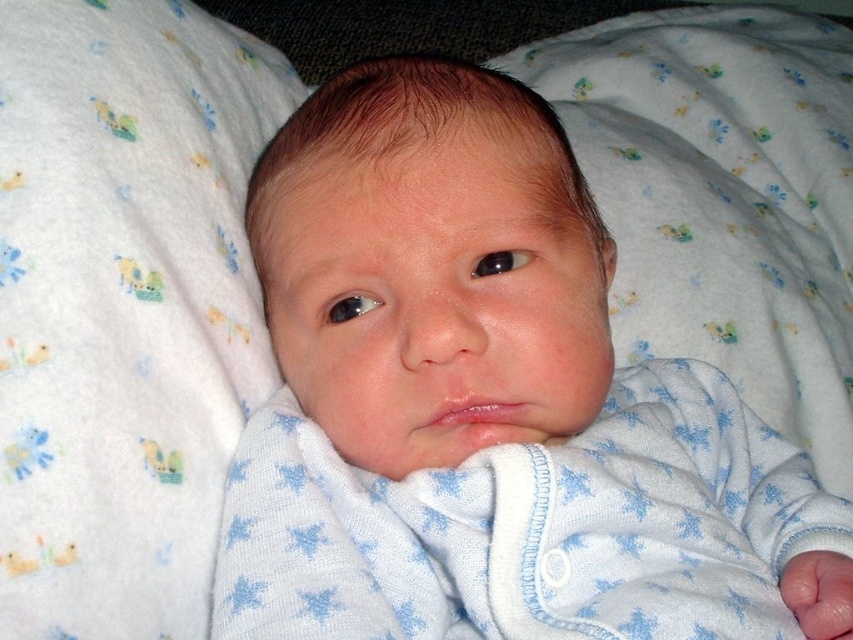
You are a photographer taking a close up of a newborn baby. You have two points marked on your screen at coordinates point [440,493] and point [693,266]. Which point is closer to the camera?

Point [440,493] is closer to the camera than point [693,266].

You are a photographer taking a closeup shot of a newborn baby. You notice two fabrics in the image, the white soft fabric baby at center and the white knit fabric at center. Which fabric is positioned closer to the camera?

The white soft fabric baby at center is closer to the viewer than the white knit fabric at center, so the white soft fabric baby at center is positioned closer to the camera.

You are a nurse preparing to swaddle a newborn baby. You have two fabrics available for swaddling the baby. One is the white soft fabric at center and the other is the white knit fabric at center. Given that the minimum required distance between the edges of the fabric and the baby is 18 inches to ensure proper swaddling, which fabric would you choose and why?

The white soft fabric at center is 18.52 inches from the white knit fabric at center. Since the minimum required distance is 18 inches, the white soft fabric at center meets the requirement and would be suitable for proper swaddling.